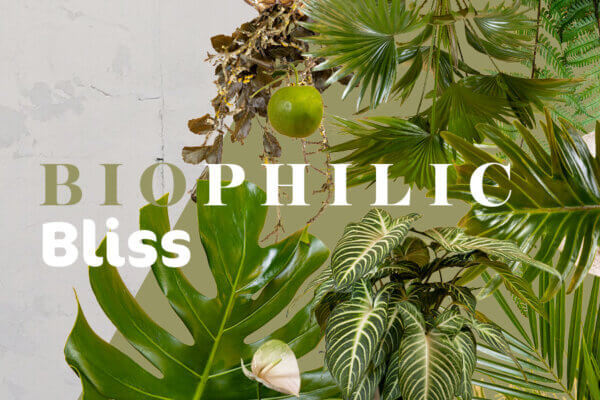
Find the location of `stains`. stains is located at coordinates (42, 103), (10, 133), (122, 55), (37, 307).